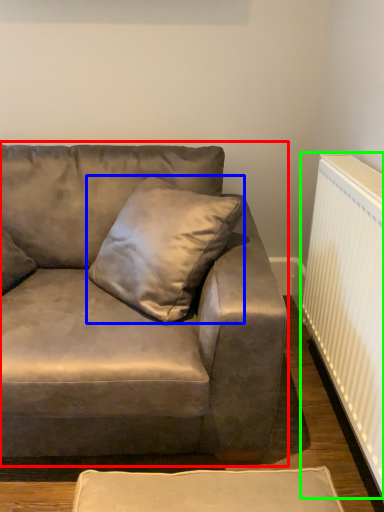
Question: Estimate the real-world distances between objects in this image. Which object is closer to studio couch (highlighted by a red box), pillow (highlighted by a blue box) or radiator (highlighted by a green box)?

Choices:
 (A) pillow
 (B) radiator

Answer: (A)